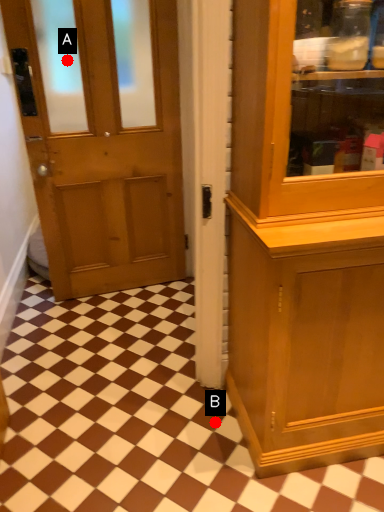
Question: Two points are circled on the image, labeled by A and B beside each circle. Which point is closer to the camera?

Choices:
 (A) A is closer
 (B) B is closer

Answer: (B)